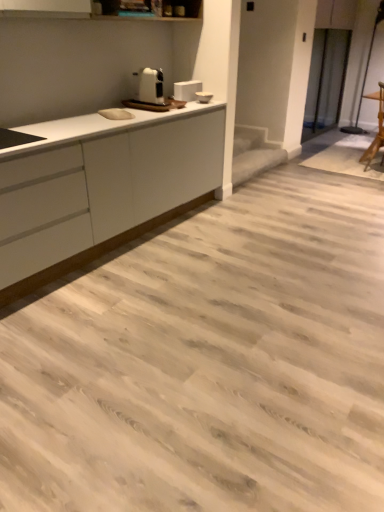
Question: From a real-world perspective, is white matte countertop at left physically located above or below wooden chair at right?

Choices:
 (A) above
 (B) below

Answer: (B)

Question: Considering their positions, is white matte countertop at left located in front of or behind wooden chair at right?

Choices:
 (A) behind
 (B) front

Answer: (B)

Question: Estimate the real-world distances between objects in this image. Which object is farther from the white glossy toaster at upper center?

Choices:
 (A) wooden chair at right
 (B) white matte countertop at left
 (C) white plastic toaster at upper center

Answer: (A)

Question: Which is nearer to the white plastic toaster at upper center?

Choices:
 (A) wooden chair at right
 (B) white matte countertop at left
 (C) white glossy toaster at upper center

Answer: (C)